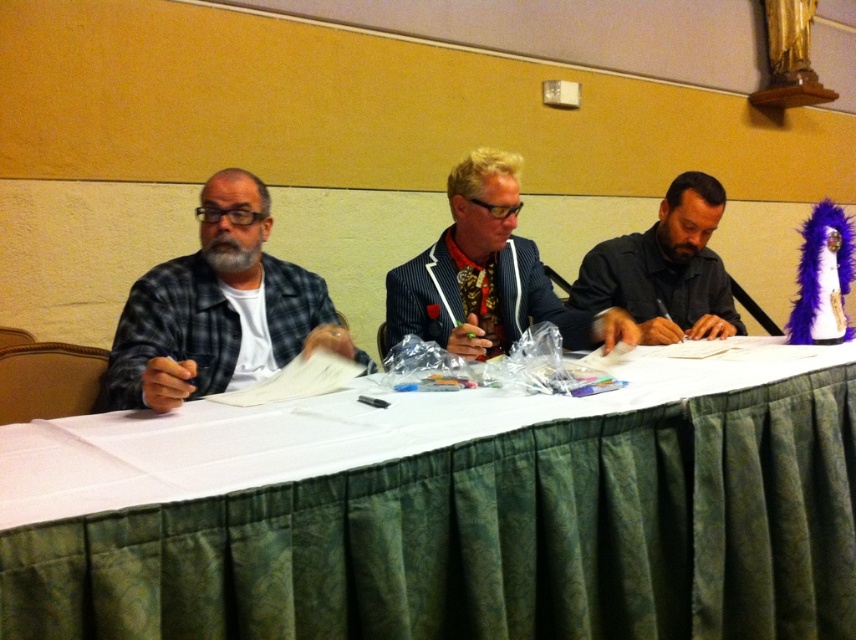
Question: Which is farther from the green textured tablecloth at center?

Choices:
 (A) plaid fabric shirt at left
 (B) striped fabric suit at center

Answer: (B)

Question: Which point appears farthest from the camera in this image?

Choices:
 (A) (634, 298)
 (B) (337, 486)
 (C) (295, 273)

Answer: (A)

Question: Is green textured tablecloth at center thinner than dark gray shirt at right?

Choices:
 (A) yes
 (B) no

Answer: (B)

Question: Can you confirm if green textured tablecloth at center is positioned below plaid fabric shirt at left?

Choices:
 (A) no
 (B) yes

Answer: (B)

Question: Does green textured tablecloth at center have a lesser width compared to plaid fabric shirt at left?

Choices:
 (A) no
 (B) yes

Answer: (A)

Question: Which of the following is the farthest from the observer?

Choices:
 (A) green textured tablecloth at center
 (B) striped fabric suit at center
 (C) plaid fabric shirt at left

Answer: (B)